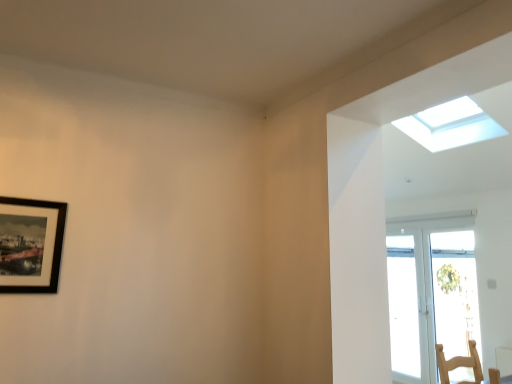
What do you see at coordinates (450, 125) in the screenshot? I see `transparent glass window at upper right` at bounding box center [450, 125].

This screenshot has width=512, height=384. In order to click on transparent glass window at upper right in this screenshot , I will do click(450, 125).

What do you see at coordinates (31, 246) in the screenshot?
I see `black matte picture frame at upper left` at bounding box center [31, 246].

Locate an element on the screen. black matte picture frame at upper left is located at coordinates [x=31, y=246].

Measure the distance between black matte picture frame at upper left and camera.

The distance of black matte picture frame at upper left from camera is 6.33 feet.

Where is `transparent glass window at upper right`? The height and width of the screenshot is (384, 512). transparent glass window at upper right is located at coordinates (450, 125).

Can you confirm if transparent glass window at upper right is positioned to the left of black matte picture frame at upper left?

Incorrect, transparent glass window at upper right is not on the left side of black matte picture frame at upper left.

Based on the photo, relative to black matte picture frame at upper left, is transparent glass window at upper right in front or behind?

transparent glass window at upper right is behind black matte picture frame at upper left.

Considering the points (455, 147) and (15, 260), which point is in front, point (455, 147) or point (15, 260)?

The point (15, 260) is more forward.

From the image's perspective, does transparent glass window at upper right appear lower than black matte picture frame at upper left?

No.

From a real-world perspective, who is located higher, transparent glass window at upper right or black matte picture frame at upper left?

transparent glass window at upper right, from a real-world perspective.

Considering the sizes of transparent glass window at upper right and black matte picture frame at upper left in the image, is transparent glass window at upper right wider or thinner than black matte picture frame at upper left?

Considering their sizes, transparent glass window at upper right looks broader than black matte picture frame at upper left.

Considering the relative sizes of transparent glass window at upper right and black matte picture frame at upper left in the image provided, is transparent glass window at upper right taller than black matte picture frame at upper left?

No.

Between transparent glass window at upper right and black matte picture frame at upper left, which one has smaller size?

With smaller size is black matte picture frame at upper left.

Would you say transparent glass window at upper right is inside or outside black matte picture frame at upper left?

transparent glass window at upper right cannot be found inside black matte picture frame at upper left.

Is transparent glass window at upper right in contact with black matte picture frame at upper left?

transparent glass window at upper right is not next to black matte picture frame at upper left, and they're not touching.

Is transparent glass window at upper right turned away from black matte picture frame at upper left?

No, transparent glass window at upper right is not facing the opposite direction of black matte picture frame at upper left.

Where is `window on the right of black matte picture frame at upper left`? window on the right of black matte picture frame at upper left is located at coordinates (450, 125).

Does black matte picture frame at upper left appear on the left side of transparent glass window at upper right?

Yes, black matte picture frame at upper left is to the left of transparent glass window at upper right.

Between black matte picture frame at upper left and transparent glass window at upper right, which one is positioned in front?

black matte picture frame at upper left is in front.

Considering the points (18, 259) and (423, 121), which point is in front, point (18, 259) or point (423, 121)?

The point (18, 259) is closer to the camera.

From the image's perspective, is black matte picture frame at upper left under transparent glass window at upper right?

Yes, from the image's perspective, black matte picture frame at upper left is below transparent glass window at upper right.

From a real-world perspective, between black matte picture frame at upper left and transparent glass window at upper right, who is vertically higher?

transparent glass window at upper right, from a real-world perspective.

Considering the sizes of objects black matte picture frame at upper left and transparent glass window at upper right in the image provided, who is wider, black matte picture frame at upper left or transparent glass window at upper right?

With larger width is transparent glass window at upper right.

Who is shorter, black matte picture frame at upper left or transparent glass window at upper right?

With less height is transparent glass window at upper right.

Which of these two, black matte picture frame at upper left or transparent glass window at upper right, is smaller?

Smaller between the two is black matte picture frame at upper left.

From the picture: Which is correct: black matte picture frame at upper left is inside transparent glass window at upper right, or outside of it?

black matte picture frame at upper left is not enclosed by transparent glass window at upper right.

Can you see black matte picture frame at upper left touching transparent glass window at upper right?

There is a gap between black matte picture frame at upper left and transparent glass window at upper right.

Is black matte picture frame at upper left oriented towards transparent glass window at upper right?

No.

Can you tell me how much black matte picture frame at upper left and transparent glass window at upper right differ in facing direction?

94.5 degrees.

Identify the location of window on the right of the black matte picture frame at upper left. The image size is (512, 384). (450, 125).

This screenshot has height=384, width=512. In order to click on window on the right of black matte picture frame at upper left in this screenshot , I will do `click(450, 125)`.

The image size is (512, 384). In the image, there is a transparent glass window at upper right. Find the location of `picture frame below it (from a real-world perspective)`. picture frame below it (from a real-world perspective) is located at coordinates (31, 246).